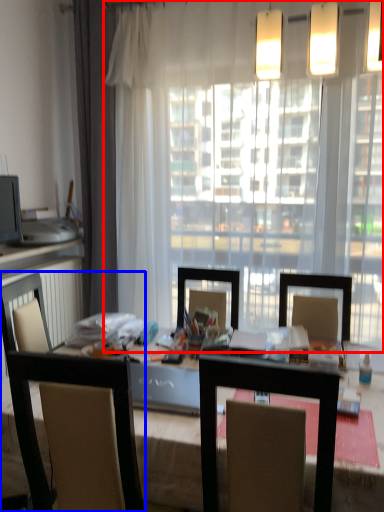
Question: Which object appears farthest to the camera in this image, window (highlighted by a red box) or chair (highlighted by a blue box)?

Choices:
 (A) window
 (B) chair

Answer: (A)